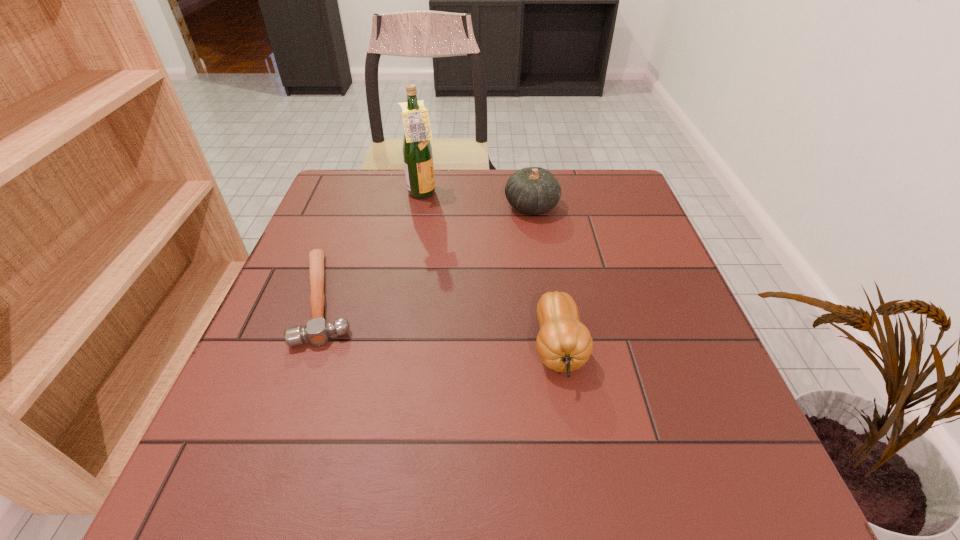
Select which object appears as the closest to the tallest object. Please provide its 2D coordinates. Your answer should be formatted as a tuple, i.e. [(x, y)], where the tuple contains the x and y coordinates of a point satisfying the conditions above.

[(532, 190)]

Locate an element on the screen. free space that satisfies the following two spatial constraints: 1. on the front-facing side of the tallest object; 2. on the right side of the farther gourd is located at coordinates (420, 206).

Locate an element on the screen. free location that satisfies the following two spatial constraints: 1. on the front-facing side of the second object from left to right; 2. on the left side of the farther gourd is located at coordinates (420, 206).

Locate an element on the screen. The height and width of the screenshot is (540, 960). free space that satisfies the following two spatial constraints: 1. on the front-facing side of the third object from right to left; 2. on the front side of the leftmost object is located at coordinates (404, 298).

You are a GUI agent. You are given a task and a screenshot of the screen. Output one action in this format:
    pyautogui.click(x=<x>, y=<y>)
    Task: Click on the free spot that satisfies the following two spatial constraints: 1. on the front-facing side of the farther gourd; 2. on the right side of the tallest object
    This screenshot has height=540, width=960.
    Given the screenshot: What is the action you would take?
    pyautogui.click(x=420, y=206)

Find the location of a particular element. This screenshot has height=540, width=960. vacant region that satisfies the following two spatial constraints: 1. on the back side of the shortest object; 2. on the right side of the farther gourd is located at coordinates [359, 206].